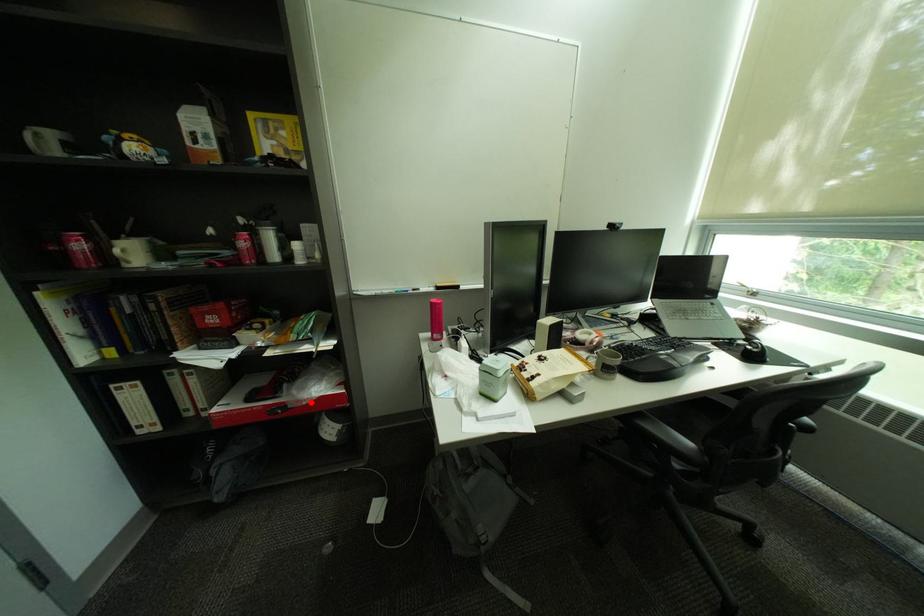
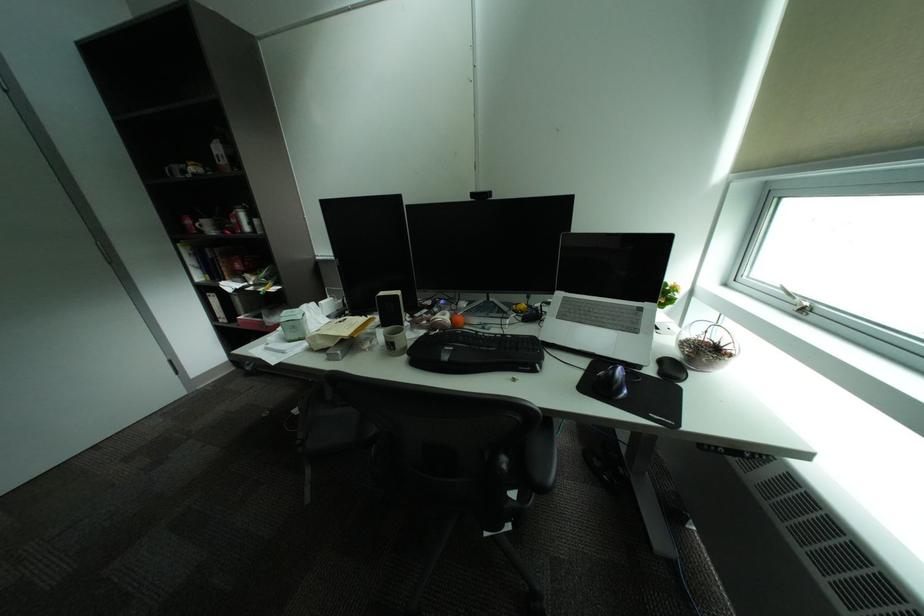
In the second image, find the point that corresponds to the highlighted location in the first image.

(281, 323)